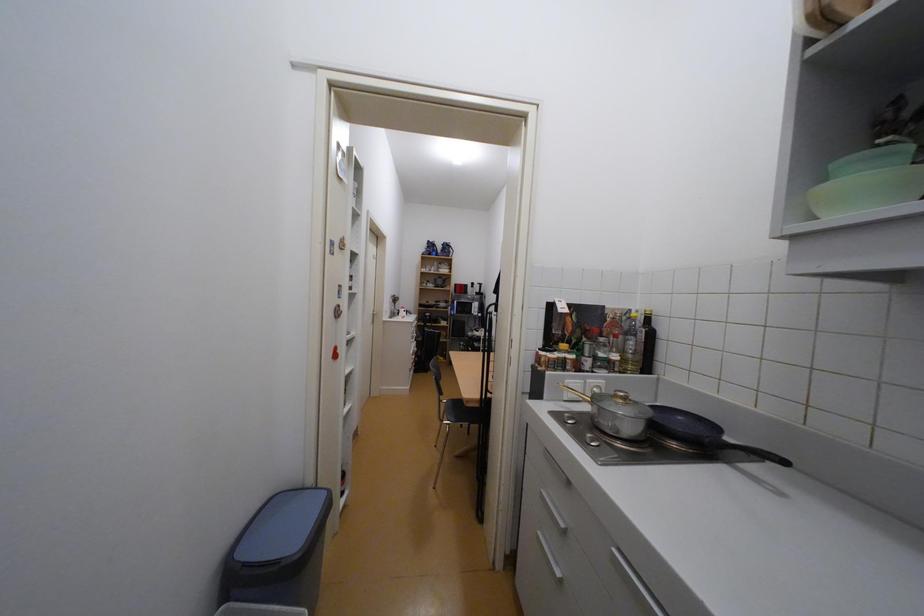
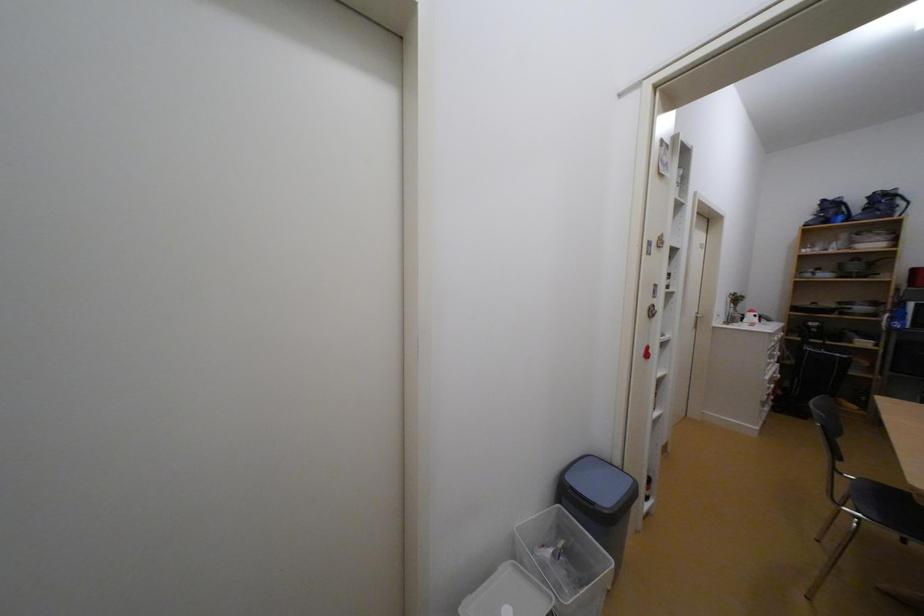
Question: The camera is either moving clockwise (left) or counter-clockwise (right) around the object. The first image is from the beginning of the video and the second image is from the end. Is the camera moving left or right when shooting the video?

Choices:
 (A) Left
 (B) Right

Answer: (B)